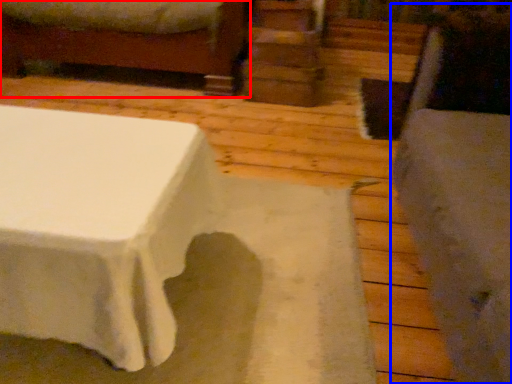
Question: Which of the following is the farthest to the observer, furniture (highlighted by a red box) or swivel chair (highlighted by a blue box)?

Choices:
 (A) furniture
 (B) swivel chair

Answer: (A)